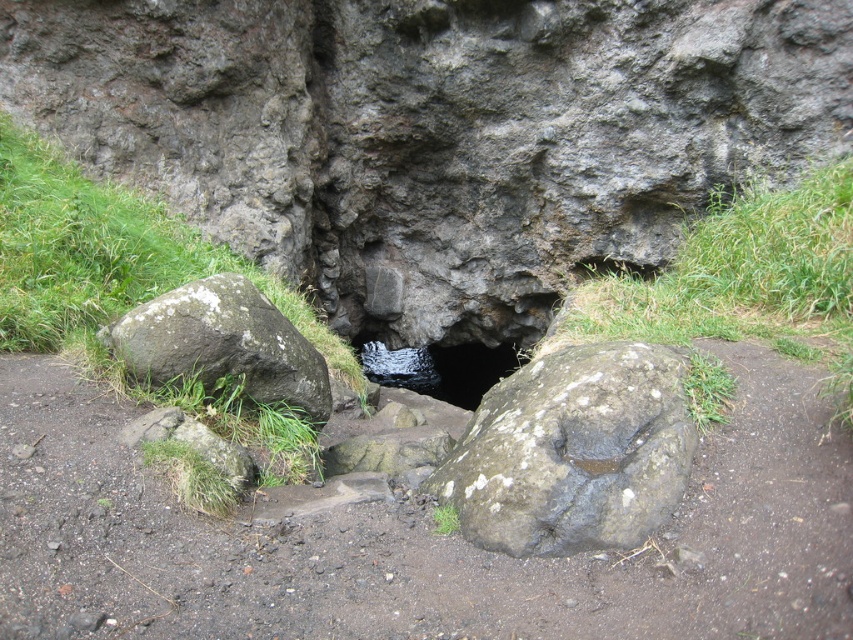
Question: Is gray rough rock at center closer to camera compared to green grassy rock at center?

Choices:
 (A) no
 (B) yes

Answer: (B)

Question: Which object is the closest to the gray rough rock at center?

Choices:
 (A) green grassy rock at center
 (B) black rock hole at center

Answer: (A)

Question: Does dull gray stone at center appear on the left side of gray rough rock at left?

Choices:
 (A) no
 (B) yes

Answer: (A)

Question: Which is nearer to the black rock hole at center?

Choices:
 (A) gray rough rock at center
 (B) gray rough rock at left
 (C) green grassy rock at center

Answer: (C)

Question: Estimate the real-world distances between objects in this image. Which object is farther from the green grassy patch at center?

Choices:
 (A) gray rough rock at center
 (B) gray rough rock at left

Answer: (B)

Question: Is green grassy patch at center bigger than gray rough rock at left?

Choices:
 (A) no
 (B) yes

Answer: (B)